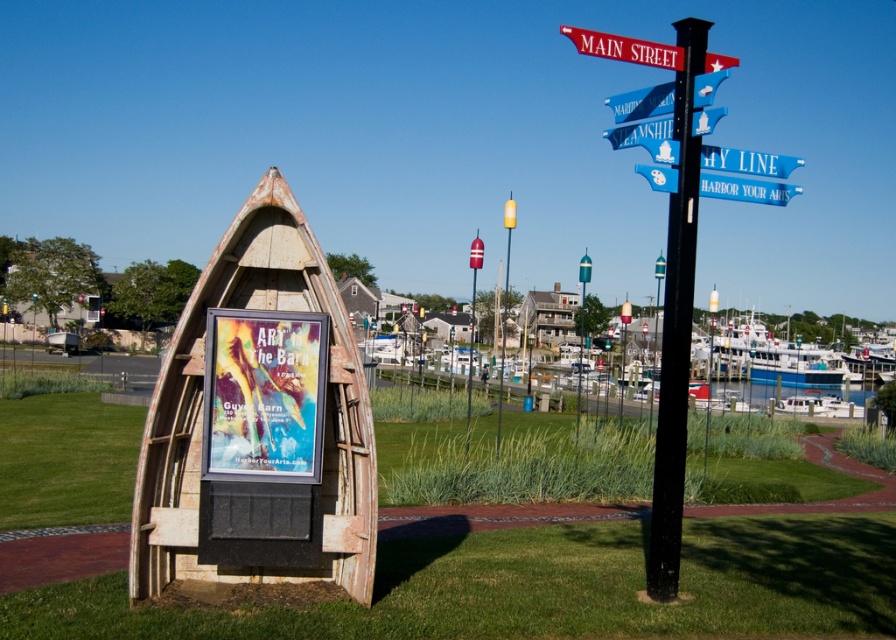
Question: Which point is farther from the camera taking this photo?

Choices:
 (A) (668, 330)
 (B) (645, 44)
 (C) (651, 144)
 (D) (369, 472)

Answer: (C)

Question: Which of the following is the farthest from the observer?

Choices:
 (A) black metal pole at center
 (B) metallic poster at center
 (C) green grass at lower center
 (D) rustic wood boat at center

Answer: (D)

Question: Which object is positioned farthest from the blue plastic street sign at upper center?

Choices:
 (A) blue painted wood street sign at upper right
 (B) green grass at lower center
 (C) rusty wood canoe at center

Answer: (B)

Question: Is red painted metal signpost at upper center below blue plastic street sign at upper center?

Choices:
 (A) no
 (B) yes

Answer: (A)

Question: Is blue painted wood street sign at upper right further to the viewer compared to blue plastic street sign at upper center?

Choices:
 (A) no
 (B) yes

Answer: (B)

Question: From the image, what is the correct spatial relationship of black metal pole at center in relation to rustic wood boat at center?

Choices:
 (A) left
 (B) right

Answer: (A)